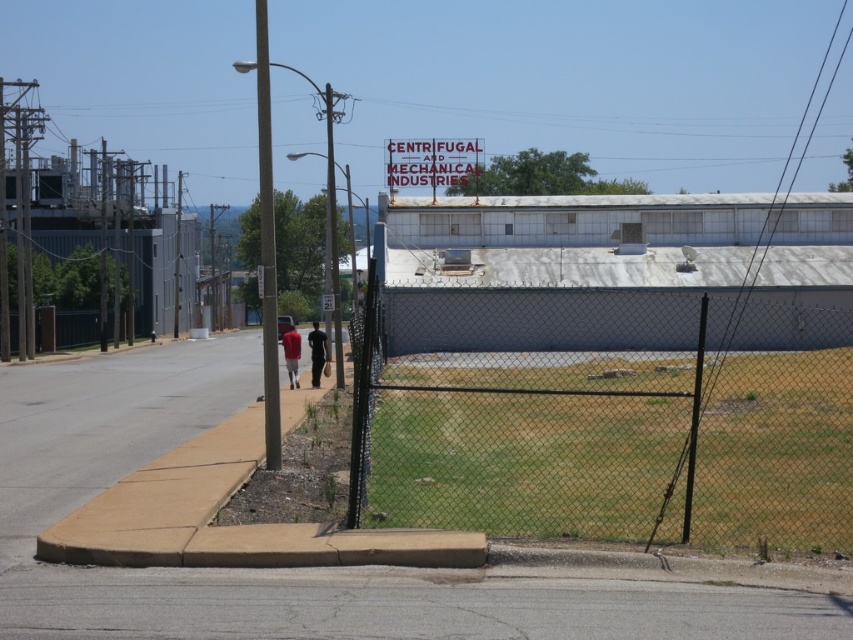
From the picture: Is chain-link fence at center below black fabric pants at center?

Incorrect, chain-link fence at center is not positioned below black fabric pants at center.

Does point (405, 321) lie in front of point (316, 349)?

No, it is not.

Find the location of a particular element. chain-link fence at center is located at coordinates (605, 417).

Does gray asphalt pavement at lower center have a lesser height compared to matte red shirt at center?

Yes, gray asphalt pavement at lower center is shorter than matte red shirt at center.

Between gray asphalt pavement at lower center and matte red shirt at center, which one has more height?

With more height is matte red shirt at center.

Where is `gray asphalt pavement at lower center`? The height and width of the screenshot is (640, 853). gray asphalt pavement at lower center is located at coordinates (396, 605).

You are a GUI agent. You are given a task and a screenshot of the screen. Output one action in this format:
    pyautogui.click(x=<x>, y=<y>)
    Task: Click on the gray asphalt pavement at lower center
    This screenshot has width=853, height=640.
    Given the screenshot: What is the action you would take?
    pyautogui.click(x=396, y=605)

Does gray asphalt pavement at lower center have a greater width compared to black fabric pants at center?

Yes.

Is gray asphalt pavement at lower center to the right of black fabric pants at center from the viewer's perspective?

Correct, you'll find gray asphalt pavement at lower center to the right of black fabric pants at center.

The width and height of the screenshot is (853, 640). Identify the location of gray asphalt pavement at lower center. (396, 605).

Locate an element on the screen. gray asphalt pavement at lower center is located at coordinates (396, 605).